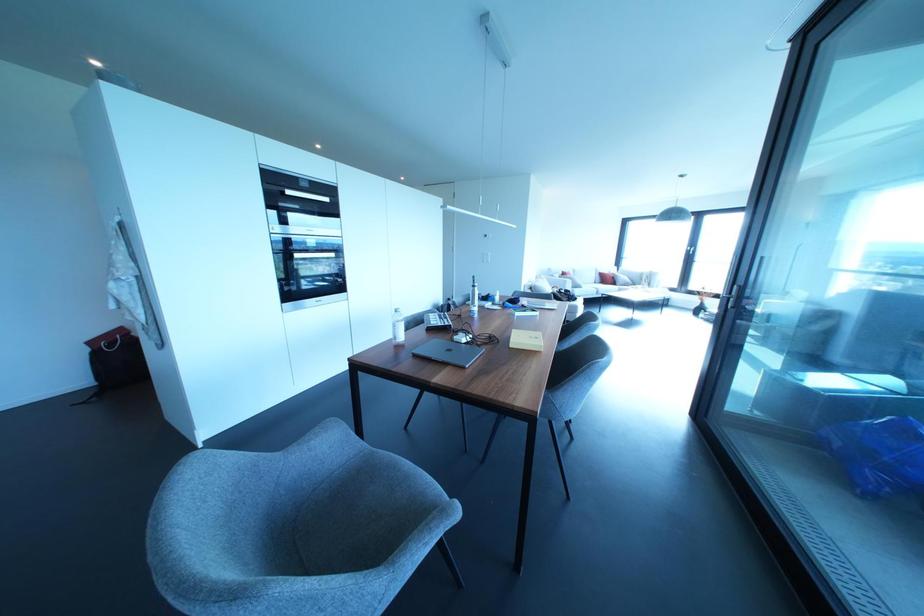
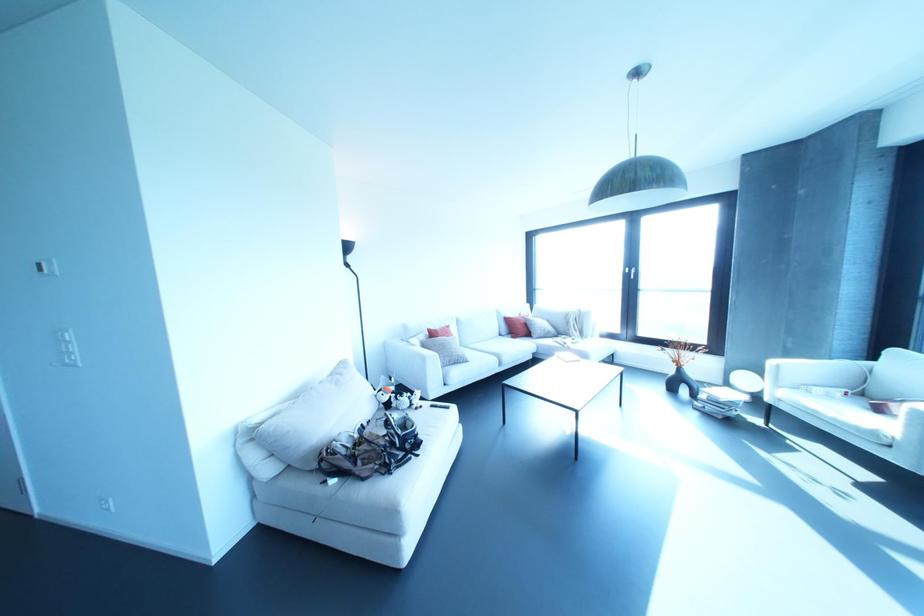
What movement of the cameraman would produce the second image?

The cameraman walked toward right, forward.